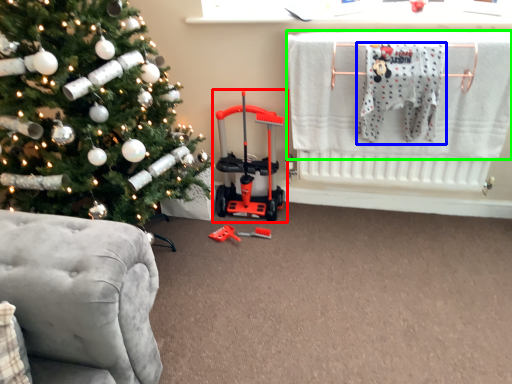
Question: Which object is the farthest from baby carriage (highlighted by a red box)? Choose among these: baby clothe (highlighted by a blue box) or laundry (highlighted by a green box).

Choices:
 (A) baby clothe
 (B) laundry

Answer: (A)